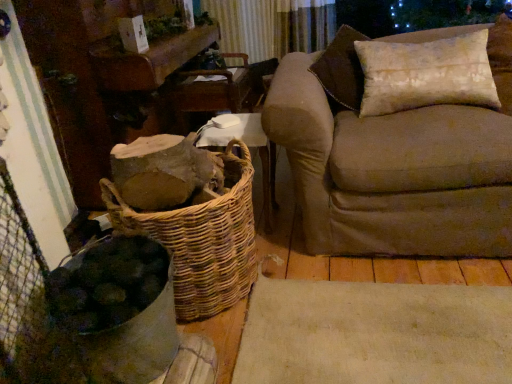
What is the approximate width of beige fabric couch at right?

3.30 feet.

Describe the element at coordinates (211, 90) in the screenshot. I see `wooden armchair at center` at that location.

What do you see at coordinates (249, 147) in the screenshot? I see `woven wood basket at center` at bounding box center [249, 147].

Looking at this image, measure the distance between woven brown basket at lower left and camera.

The distance of woven brown basket at lower left from camera is 4.00 feet.

The image size is (512, 384). Identify the location of beige fabric couch at right. [396, 160].

From the picture: Is textured beige pillow at upper right to the left or to the right of beige fabric couch at right in the image?

textured beige pillow at upper right is to the right of beige fabric couch at right.

Looking at this image, based on their sizes in the image, would you say textured beige pillow at upper right is bigger or smaller than beige fabric couch at right?

In the image, textured beige pillow at upper right appears to be smaller than beige fabric couch at right.

From a real-world perspective, relative to beige fabric couch at right, is textured beige pillow at upper right vertically above or below?

In terms of real-world spatial position, textured beige pillow at upper right is above beige fabric couch at right.

Can you confirm if wooden armchair at center is bigger than textured beige pillow at upper right?

Correct, wooden armchair at center is larger in size than textured beige pillow at upper right.

Locate an element on the screen. The width and height of the screenshot is (512, 384). armchair that appears below the textured beige pillow at upper right (from a real-world perspective) is located at coordinates (211, 90).

Considering the relative positions of wooden armchair at center and textured beige pillow at upper right in the image provided, is wooden armchair at center to the right of textured beige pillow at upper right from the viewer's perspective?

No.

Is wooden armchair at center further to the viewer compared to textured beige pillow at upper right?

Yes.

Who is more distant, textured beige pillow at upper right or wooden armchair at center?

wooden armchair at center is more distant.

Between textured beige pillow at upper right and wooden armchair at center, which one has larger width?

wooden armchair at center.

Is textured beige pillow at upper right not inside wooden armchair at center?

Yes, textured beige pillow at upper right is not within wooden armchair at center.

From a real-world perspective, is textured beige pillow at upper right positioned above or below wooden armchair at center?

In terms of real-world spatial position, textured beige pillow at upper right is above wooden armchair at center.

Is woven wood basket at center facing towards wooden armchair at center?

No.

Who is taller, woven wood basket at center or wooden armchair at center?

woven wood basket at center.

How distant is woven wood basket at center from wooden armchair at center?

They are 26.45 inches apart.

Can you confirm if woven wood basket at center is bigger than wooden armchair at center?

Actually, woven wood basket at center might be smaller than wooden armchair at center.

The image size is (512, 384). What are the coordinates of `armchair on the left of woven brown basket at lower left` in the screenshot? It's located at (211, 90).

Is woven brown basket at lower left not close to wooden armchair at center?

woven brown basket at lower left is positioned a significant distance from wooden armchair at center.

Considering the sizes of objects woven brown basket at lower left and wooden armchair at center in the image provided, who is smaller, woven brown basket at lower left or wooden armchair at center?

wooden armchair at center is smaller.

Does point (237, 212) come behind point (223, 102)?

No, (237, 212) is in front of (223, 102).

Can you confirm if wooden armchair at center is wider than beige fabric couch at right?

Incorrect, the width of wooden armchair at center does not surpass that of beige fabric couch at right.

Does point (232, 68) come behind point (482, 223)?

Yes.

Which is more to the left, wooden armchair at center or beige fabric couch at right?

Positioned to the left is wooden armchair at center.

Is wooden armchair at center located outside woven brown basket at lower left?

That's correct, wooden armchair at center is outside of woven brown basket at lower left.

Does wooden armchair at center have a lesser height compared to woven brown basket at lower left?

Correct, wooden armchair at center is not as tall as woven brown basket at lower left.

Does wooden armchair at center have a larger size compared to woven brown basket at lower left?

Actually, wooden armchair at center might be smaller than woven brown basket at lower left.

Identify the location of studio couch that is under the textured beige pillow at upper right (from a real-world perspective). This screenshot has width=512, height=384. (396, 160).

Image resolution: width=512 pixels, height=384 pixels. In order to click on pillow lying on the right of wooden armchair at center in this screenshot , I will do [x=426, y=74].

Looking at the image, which one is located closer to wooden armchair at center, woven brown basket at lower left or woven wood basket at center?

Based on the image, woven wood basket at center appears to be nearer to wooden armchair at center.

Based on their spatial positions, is beige fabric couch at right or woven brown basket at lower left further from wooden armchair at center?

Among the two, woven brown basket at lower left is located further to wooden armchair at center.

Estimate the real-world distances between objects in this image. Which object is closer to woven wood basket at center, woven brown basket at lower left or textured beige pillow at upper right?

Based on the image, woven brown basket at lower left appears to be nearer to woven wood basket at center.

When comparing their distances from textured beige pillow at upper right, does woven brown basket at lower left or beige fabric couch at right seem closer?

The object closer to textured beige pillow at upper right is beige fabric couch at right.

When comparing their distances from woven brown basket at lower left, does textured beige pillow at upper right or wooden armchair at center seem further?

The object further to woven brown basket at lower left is wooden armchair at center.

Based on their spatial positions, is textured beige pillow at upper right or beige fabric couch at right further from woven wood basket at center?

textured beige pillow at upper right is positioned further to the anchor woven wood basket at center.

From the image, which object appears to be nearer to textured beige pillow at upper right, woven wood basket at center or woven brown basket at lower left?

woven wood basket at center.

Looking at the image, which one is located closer to woven wood basket at center, beige fabric couch at right or wooden armchair at center?

beige fabric couch at right is closer to woven wood basket at center.

Image resolution: width=512 pixels, height=384 pixels. I want to click on furniture between beige fabric couch at right and wooden armchair at center from front to back, so click(249, 147).

Where is `studio couch between wooden armchair at center and textured beige pillow at upper right`? The height and width of the screenshot is (384, 512). studio couch between wooden armchair at center and textured beige pillow at upper right is located at coordinates (396, 160).

The height and width of the screenshot is (384, 512). What are the coordinates of `studio couch situated between woven brown basket at lower left and textured beige pillow at upper right from left to right` in the screenshot? It's located at (396, 160).

Where is `furniture between wooden armchair at center and textured beige pillow at upper right`? The image size is (512, 384). furniture between wooden armchair at center and textured beige pillow at upper right is located at coordinates (249, 147).